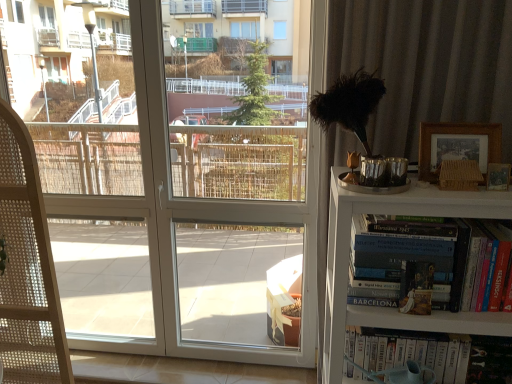
Question: Can you confirm if woven wood folding chair at left is thinner than wooden picture frame at upper right, which appears as the second picture frame when viewed from the top?

Choices:
 (A) yes
 (B) no

Answer: (B)

Question: Is woven wood folding chair at left at the right side of wooden picture frame at upper right, which appears as the second picture frame when viewed from the top?

Choices:
 (A) no
 (B) yes

Answer: (A)

Question: Is woven wood folding chair at left turned away from wooden picture frame at upper right, which appears as the second picture frame when viewed from the top?

Choices:
 (A) no
 (B) yes

Answer: (A)

Question: Is wooden picture frame at upper right, arranged as the first picture frame when ordered from the bottom, inside woven wood folding chair at left?

Choices:
 (A) no
 (B) yes

Answer: (A)

Question: Is woven wood folding chair at left not inside wooden picture frame at upper right, which appears as the second picture frame when viewed from the top?

Choices:
 (A) yes
 (B) no

Answer: (A)

Question: Does woven wood folding chair at left have a smaller size compared to wooden picture frame at upper right, arranged as the first picture frame when ordered from the bottom?

Choices:
 (A) no
 (B) yes

Answer: (A)

Question: Is the depth of woven wood folding chair at left greater than that of white wooden bookshelf at right?

Choices:
 (A) no
 (B) yes

Answer: (B)

Question: Is woven wood folding chair at left smaller than white wooden bookshelf at right?

Choices:
 (A) yes
 (B) no

Answer: (B)

Question: Does woven wood folding chair at left have a greater width compared to white wooden bookshelf at right?

Choices:
 (A) no
 (B) yes

Answer: (A)

Question: Is woven wood folding chair at left aimed at white wooden bookshelf at right?

Choices:
 (A) yes
 (B) no

Answer: (B)

Question: From a real-world perspective, is woven wood folding chair at left below white wooden bookshelf at right?

Choices:
 (A) no
 (B) yes

Answer: (A)

Question: Is white wooden bookshelf at right inside woven wood folding chair at left?

Choices:
 (A) yes
 (B) no

Answer: (B)

Question: Would you say hardcover book at right, arranged as the first book when viewed from the top, contains woven wood folding chair at left?

Choices:
 (A) yes
 (B) no

Answer: (B)